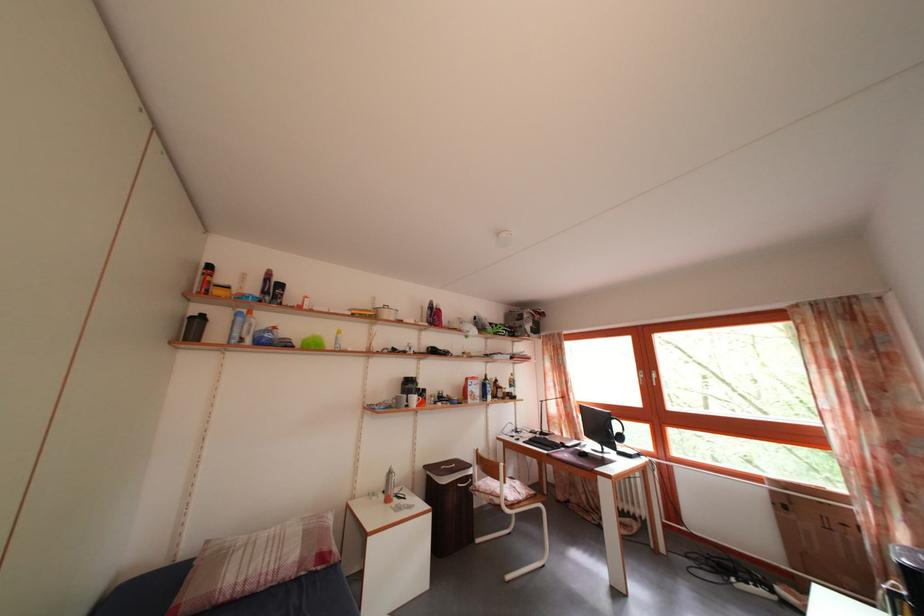
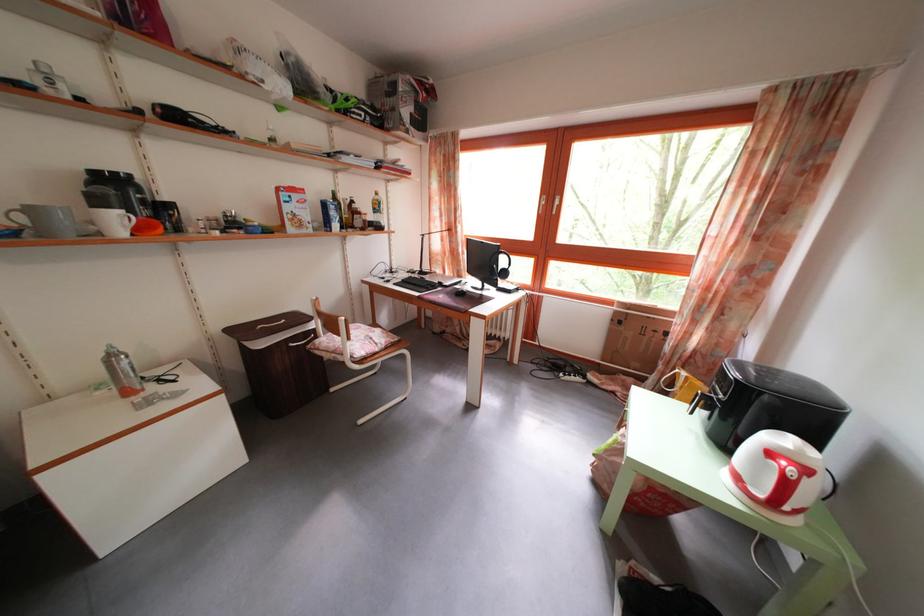
Question: I am providing you with two images of the same scene from different viewpoints. Which of the following objects are not visible in image2?

Choices:
 (A) coffee pot handle
 (B) brown glass bottle
 (C) cardboard box
 (D) none of these

Answer: (D)